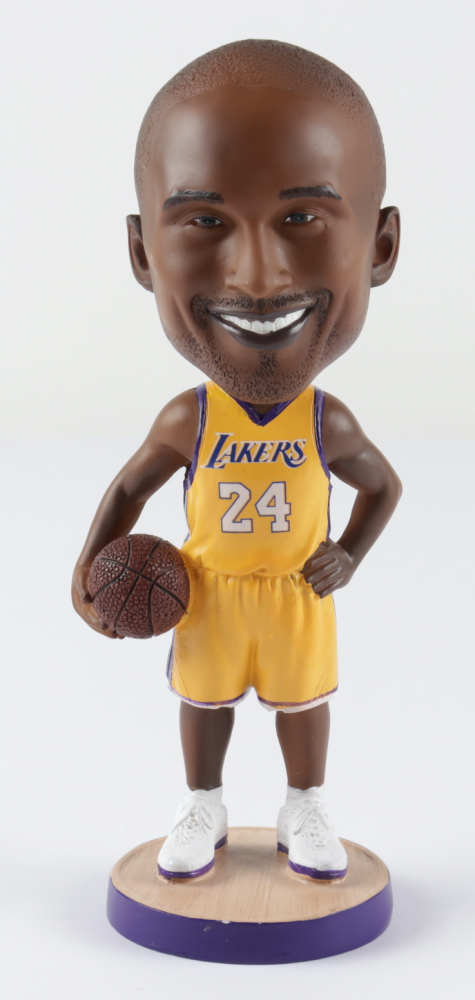
What are the coordinates of `painted purple side of base` in the screenshot? It's located at (319, 933).